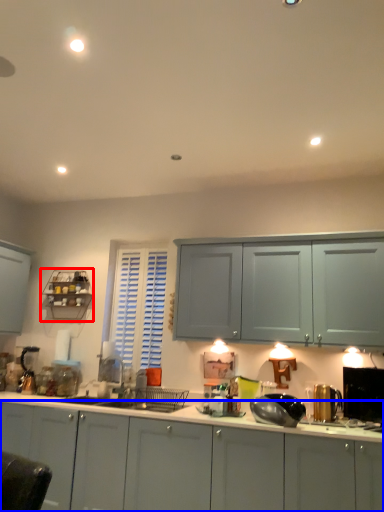
Question: Which point is closer to the camera, shelf (highlighted by a red box) or cabinetry (highlighted by a blue box)?

Choices:
 (A) shelf
 (B) cabinetry

Answer: (B)